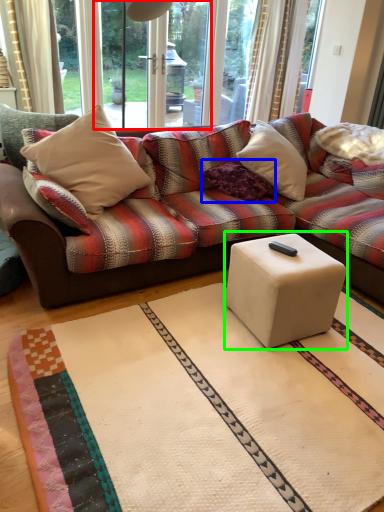
Question: Which object is the closest to the screen door (highlighted by a red box)? Choose among these: pillow (highlighted by a blue box) or coffee table (highlighted by a green box).

Choices:
 (A) pillow
 (B) coffee table

Answer: (A)